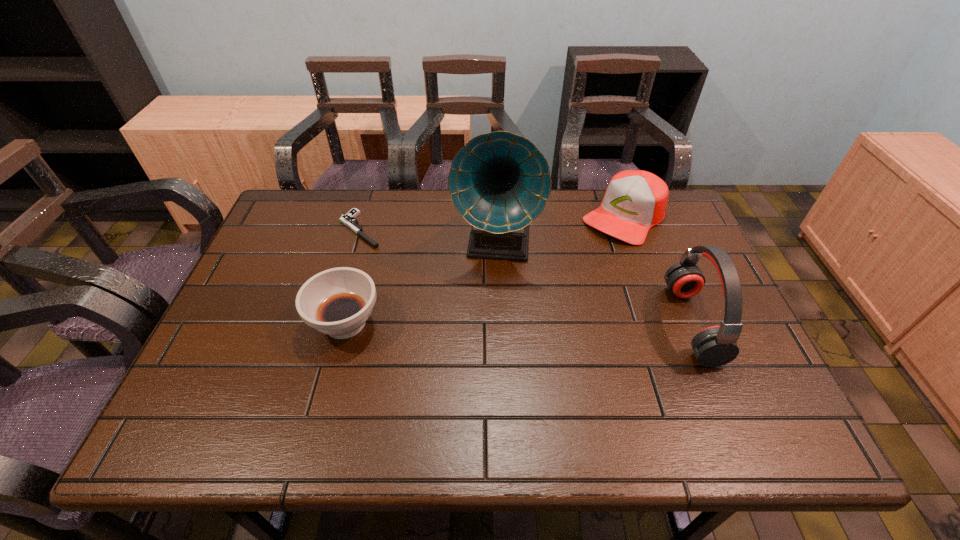
Identify which object is located as the second nearest to the third object from right to left. Please provide its 2D coordinates. Your answer should be formatted as a tuple, i.e. [(x, y)], where the tuple contains the x and y coordinates of a point satisfying the conditions above.

[(337, 302)]

You are a GUI agent. You are given a task and a screenshot of the screen. Output one action in this format:
    pyautogui.click(x=<x>, y=<y>)
    Task: Click on the object that is the closest to the pistol
    
    Given the screenshot: What is the action you would take?
    pyautogui.click(x=337, y=302)

Locate an element on the screen. This screenshot has width=960, height=540. vacant space that satisfies the following two spatial constraints: 1. on the front side of the tallest object; 2. on the ear cups of the second tallest object is located at coordinates (498, 323).

Where is `free location that satisfies the following two spatial constraints: 1. on the front side of the shortest object; 2. on the right side of the soup bowl`? The height and width of the screenshot is (540, 960). free location that satisfies the following two spatial constraints: 1. on the front side of the shortest object; 2. on the right side of the soup bowl is located at coordinates (332, 323).

Identify the location of vacant area that satisfies the following two spatial constraints: 1. on the front side of the baseball cap; 2. on the ear cups of the fourth shortest object. The image size is (960, 540). (663, 323).